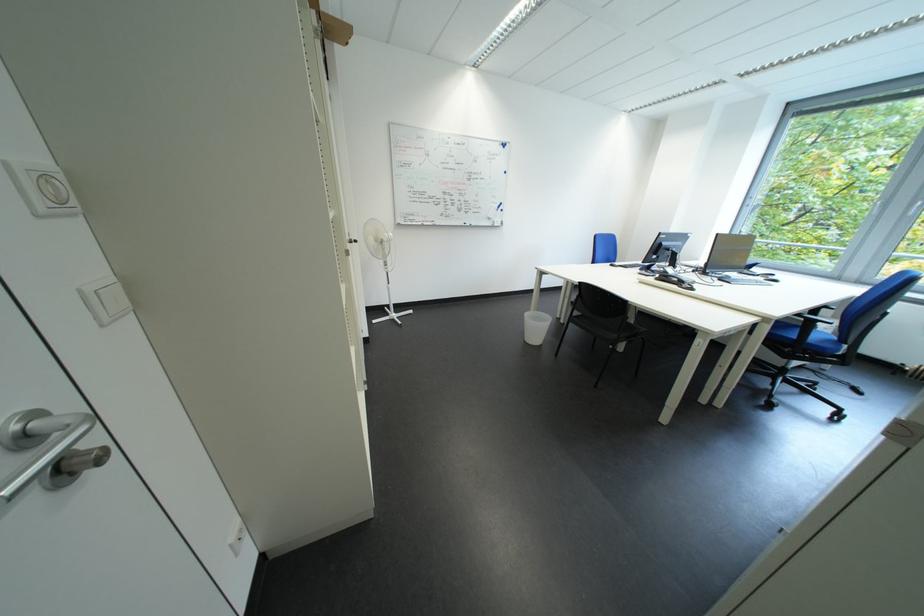
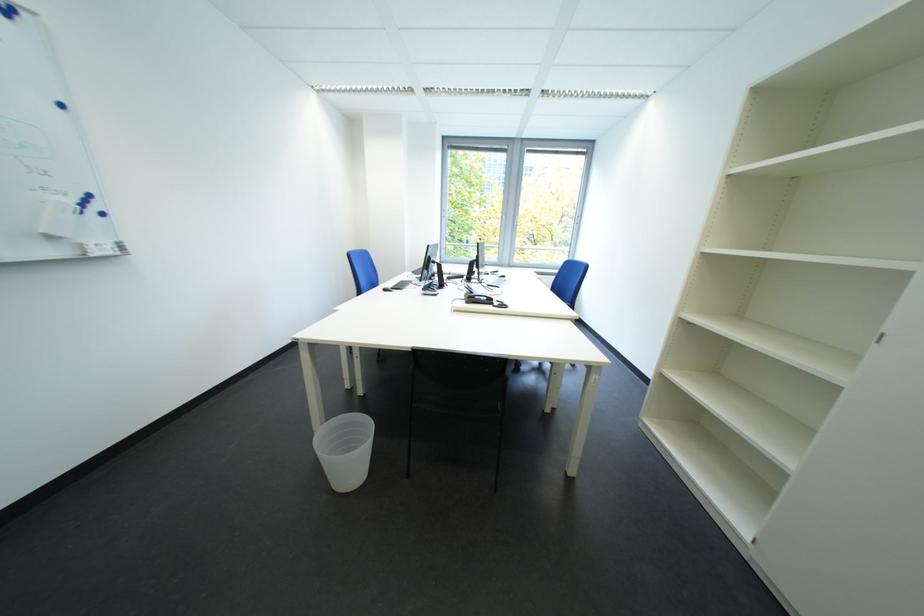
The point at (628, 265) is marked in the first image. Where is the corresponding point in the second image?

(402, 288)